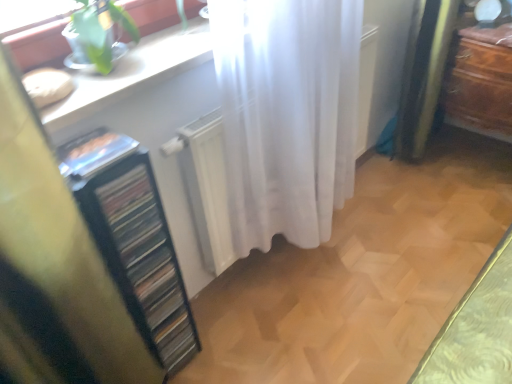
Find the location of a particular element. empty space that is ontop of black plastic file cabinet at left is located at coordinates (91, 152).